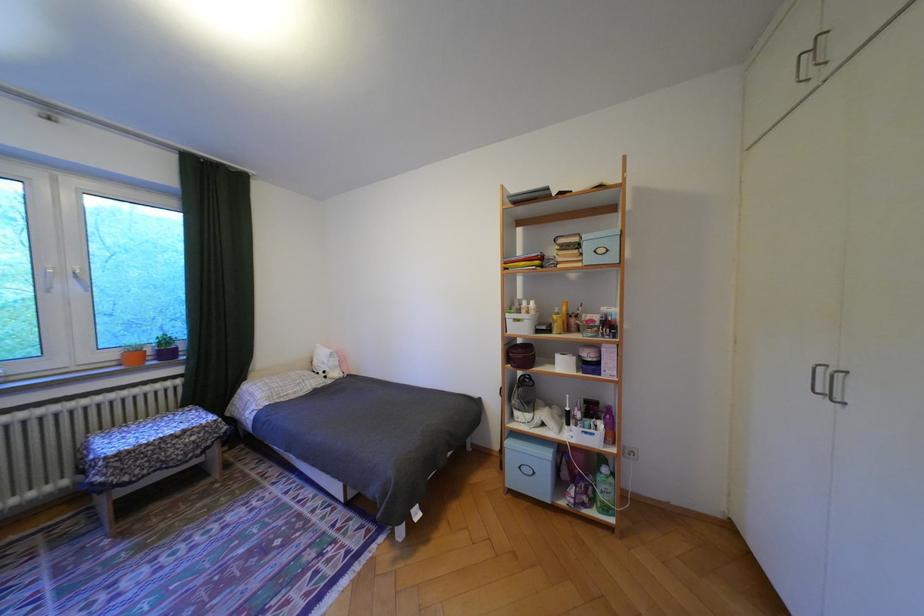
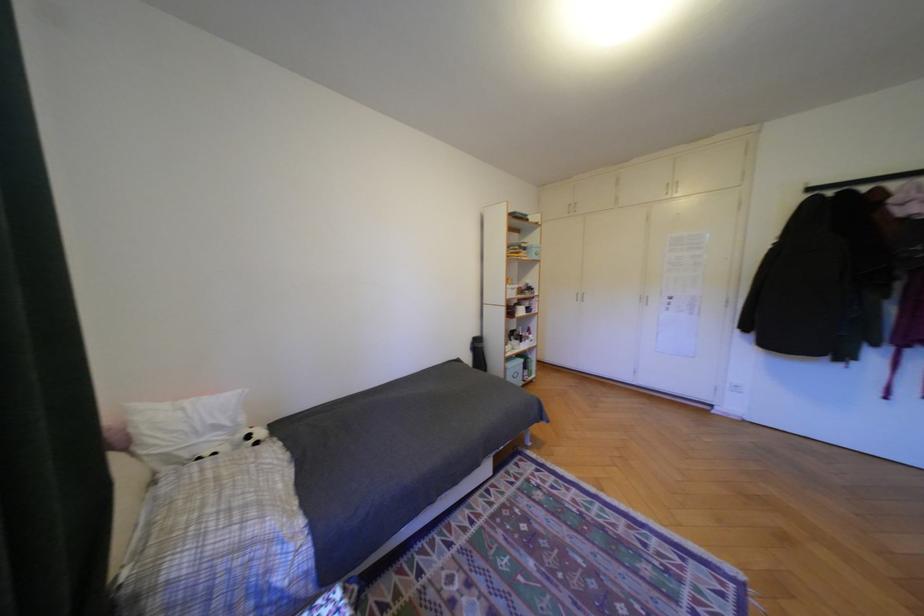
Where in the second image is the point corresponding to (334,363) from the first image?

(228, 427)